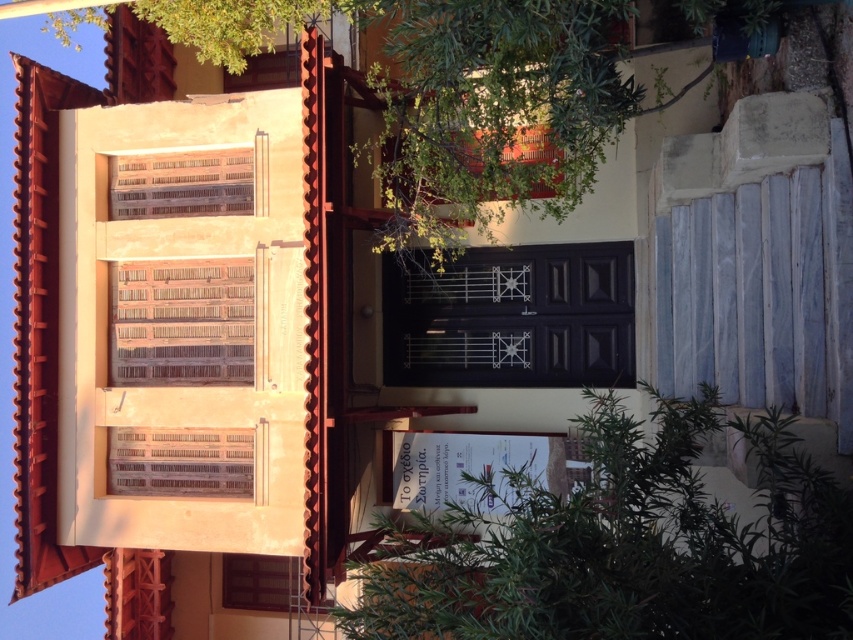
You are a visitor approaching the building and want to enter through the black double door. Which object, the white marble stairs at right or the wooden slats at center, must you step over to reach the door?

The white marble stairs at right is positioned over the wooden slats at center, so you must step over the wooden slats at center to reach the door.

You are an architect assessing the building facade. The black matte door at center and wooden slats at center are both at the center of the building. Which one has a greater height?

The black matte door at center has a greater height compared to the wooden slats at center.